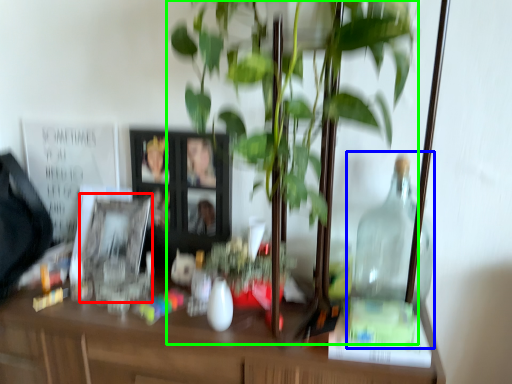
Question: Which object is the closest to the picture frame (highlighted by a red box)? Choose among these: glass jar (highlighted by a blue box) or houseplant (highlighted by a green box).

Choices:
 (A) glass jar
 (B) houseplant

Answer: (B)